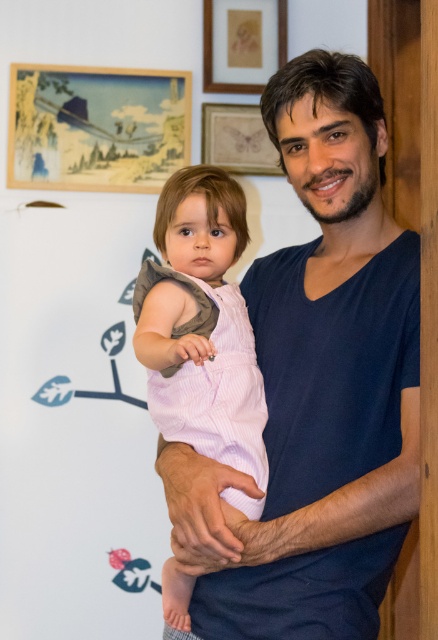
Question: Estimate the real-world distances between objects in this image. Which object is farther from the pink striped overalls at center?

Choices:
 (A) matte wooden picture frame at upper center
 (B) gold textured frame at upper center
 (C) dark blue t-shirt at center
 (D) wooden picture frame at upper left

Answer: (B)

Question: Which object is farther from the camera taking this photo?

Choices:
 (A) dark blue t-shirt at center
 (B) matte wooden picture frame at upper center
 (C) gold textured frame at upper center
 (D) wooden picture frame at upper left

Answer: (B)

Question: Does pink striped overalls at center have a smaller size compared to matte wooden picture frame at upper center?

Choices:
 (A) yes
 (B) no

Answer: (B)

Question: Does wooden picture frame at upper left have a smaller size compared to matte wooden picture frame at upper center?

Choices:
 (A) yes
 (B) no

Answer: (B)

Question: Can you confirm if dark blue t-shirt at center is positioned to the left of pink striped overalls at center?

Choices:
 (A) no
 (B) yes

Answer: (A)

Question: Which of these objects is positioned closest to the wooden picture frame at upper left?

Choices:
 (A) dark blue t-shirt at center
 (B) gold textured frame at upper center

Answer: (B)